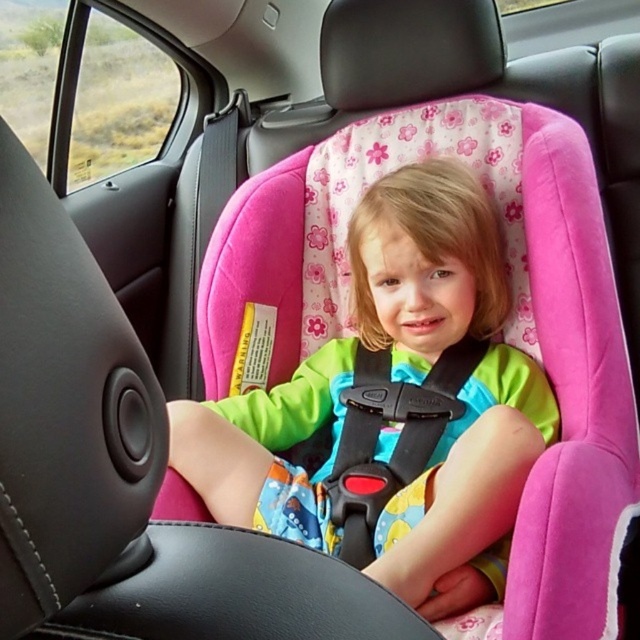
Between pink fabric car seat at center and black plastic seatbelt at center, which one has less height?

black plastic seatbelt at center

The image size is (640, 640). Identify the location of pink fabric car seat at center. (394, 406).